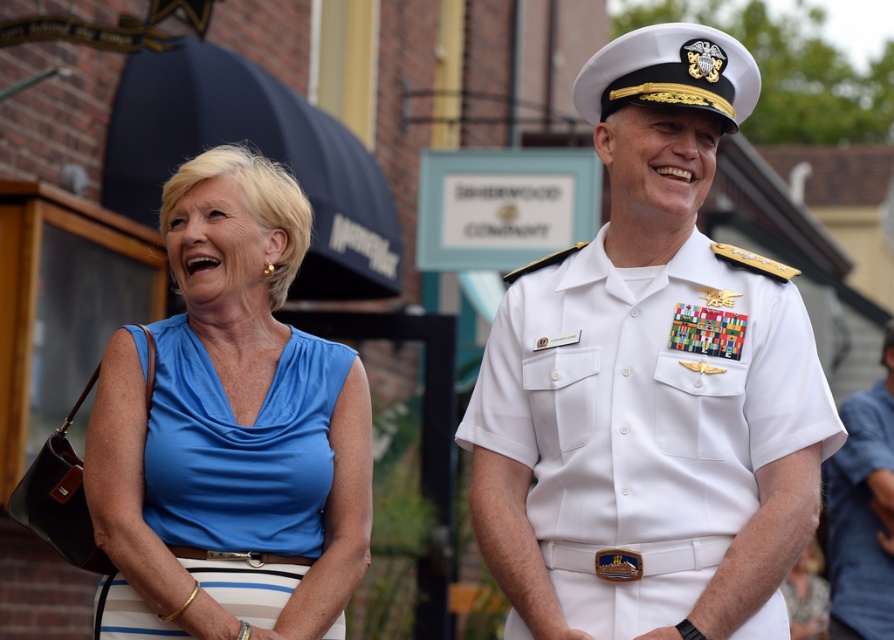
Which is more to the right, white uniform at center or white uniform at right?

From the viewer's perspective, white uniform at right appears more on the right side.

Which is in front, point (635, 385) or point (873, 522)?

Point (635, 385) is more forward.

Locate an element on the screen. The width and height of the screenshot is (894, 640). white uniform at center is located at coordinates (650, 385).

Is satin blue blouse at left smaller than white uniform at right?

Yes.

Between point (129, 556) and point (866, 532), which one is positioned behind?

Point (866, 532)

Locate an element on the screen. The image size is (894, 640). satin blue blouse at left is located at coordinates (230, 432).

The width and height of the screenshot is (894, 640). Describe the element at coordinates (650, 385) in the screenshot. I see `white uniform at center` at that location.

Based on the photo, between white uniform at center and satin blue blouse at left, which one has more height?

satin blue blouse at left is taller.

Where is `white uniform at center`? The width and height of the screenshot is (894, 640). white uniform at center is located at coordinates (650, 385).

Find the location of `white uniform at center`. white uniform at center is located at coordinates (650, 385).